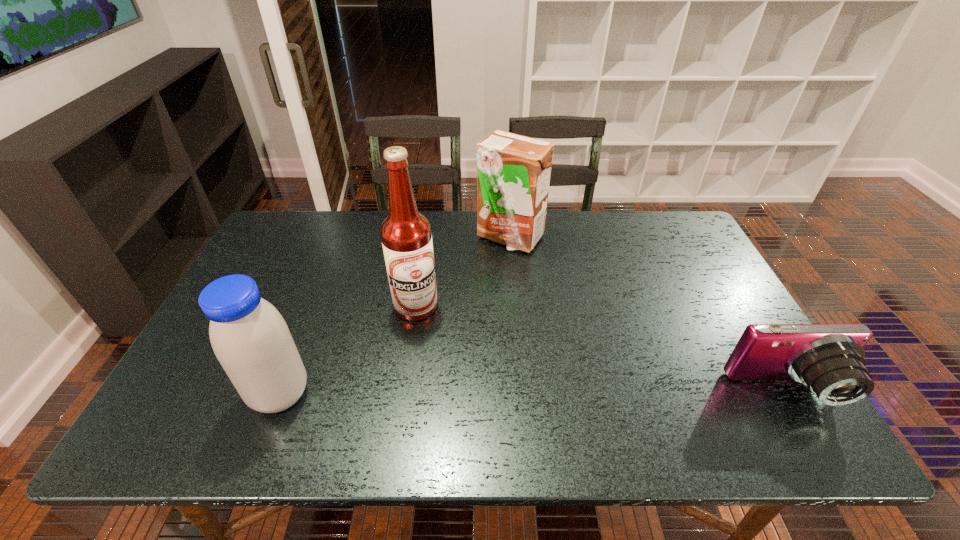
Image resolution: width=960 pixels, height=540 pixels. Find the location of `vacant space at the near edge`. vacant space at the near edge is located at coordinates (418, 375).

Locate an element on the screen. vacant space at the right edge of the desktop is located at coordinates (702, 312).

What are the coordinates of `vacant position at the far left corner of the desktop` in the screenshot? It's located at (318, 215).

Image resolution: width=960 pixels, height=540 pixels. In the image, there is a desktop. Identify the location of free region at the near left corner. (228, 384).

This screenshot has height=540, width=960. In the image, there is a desktop. Find the location of `vacant space at the far right corner`. vacant space at the far right corner is located at coordinates (648, 230).

Identify the location of empty location between the third object from left to right and the rightmost object. (648, 314).

Where is `free space that is in between the leftmost object and the rightmost object`? The height and width of the screenshot is (540, 960). free space that is in between the leftmost object and the rightmost object is located at coordinates (534, 393).

Where is `free space between the tallest object and the rightmost object`? This screenshot has height=540, width=960. free space between the tallest object and the rightmost object is located at coordinates (602, 349).

You are a GUI agent. You are given a task and a screenshot of the screen. Output one action in this format:
    pyautogui.click(x=<x>, y=<y>)
    Task: Click on the vacant point located between the alcohol and the farthest object
    This screenshot has width=960, height=540.
    Given the screenshot: What is the action you would take?
    pyautogui.click(x=463, y=272)

Locate an element on the screen. empty space that is in between the third object from right to left and the soya milk is located at coordinates (348, 350).